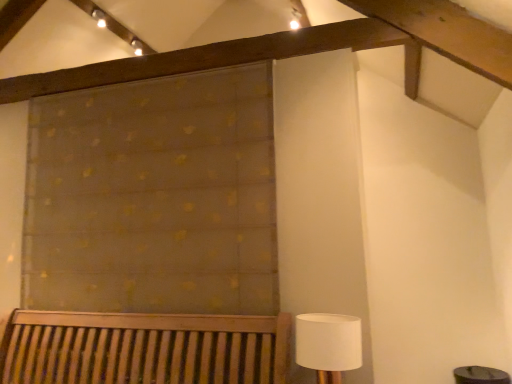
Question: Visually, is white fabric lampshade at lower right positioned to the left or to the right of translucent gold-patterned curtain at upper center?

Choices:
 (A) left
 (B) right

Answer: (B)

Question: Is white fabric lampshade at lower right situated inside translucent gold-patterned curtain at upper center or outside?

Choices:
 (A) outside
 (B) inside

Answer: (A)

Question: Considering the positions of point (306, 350) and point (52, 249), is point (306, 350) closer or farther from the camera than point (52, 249)?

Choices:
 (A) closer
 (B) farther

Answer: (A)

Question: Is translucent gold-patterned curtain at upper center taller or shorter than white fabric lampshade at lower right?

Choices:
 (A) tall
 (B) short

Answer: (A)

Question: Relative to white fabric lampshade at lower right, is translucent gold-patterned curtain at upper center in front or behind?

Choices:
 (A) behind
 (B) front

Answer: (A)

Question: Considering the positions of point (247, 76) and point (297, 340), is point (247, 76) closer or farther from the camera than point (297, 340)?

Choices:
 (A) farther
 (B) closer

Answer: (A)

Question: Looking at their shapes, would you say translucent gold-patterned curtain at upper center is wider or thinner than white fabric lampshade at lower right?

Choices:
 (A) wide
 (B) thin

Answer: (B)